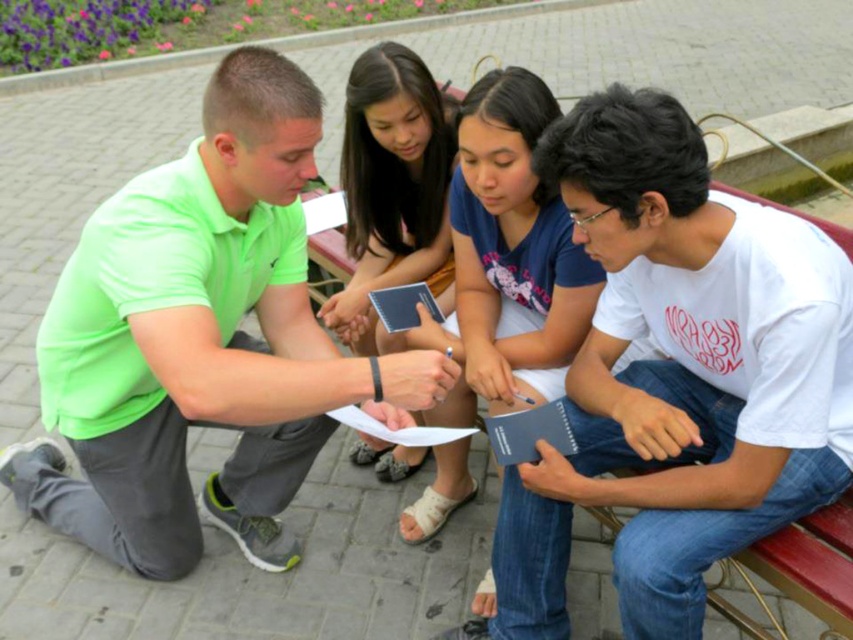
Question: Which point is closer to the camera taking this photo?

Choices:
 (A) [x=225, y=252]
 (B) [x=494, y=253]
 (C) [x=709, y=433]

Answer: (A)

Question: Which object appears closest to the camera in this image?

Choices:
 (A) blue matte notebook at center
 (B) neon green polo shirt at lower left
 (C) blue notebook at center
 (D) white matte shirt at center

Answer: (B)

Question: Where is white matte shirt at center located in relation to blue matte notebook at center in the image?

Choices:
 (A) above
 (B) below

Answer: (B)

Question: Is white matte shirt at center thinner than blue notebook at center?

Choices:
 (A) no
 (B) yes

Answer: (A)

Question: Can you confirm if white matte shirt at center is positioned to the left of blue notebook at center?

Choices:
 (A) no
 (B) yes

Answer: (A)

Question: Which point is farther to the camera?

Choices:
 (A) neon green polo shirt at lower left
 (B) blue notebook at center
 (C) white matte shirt at center

Answer: (B)